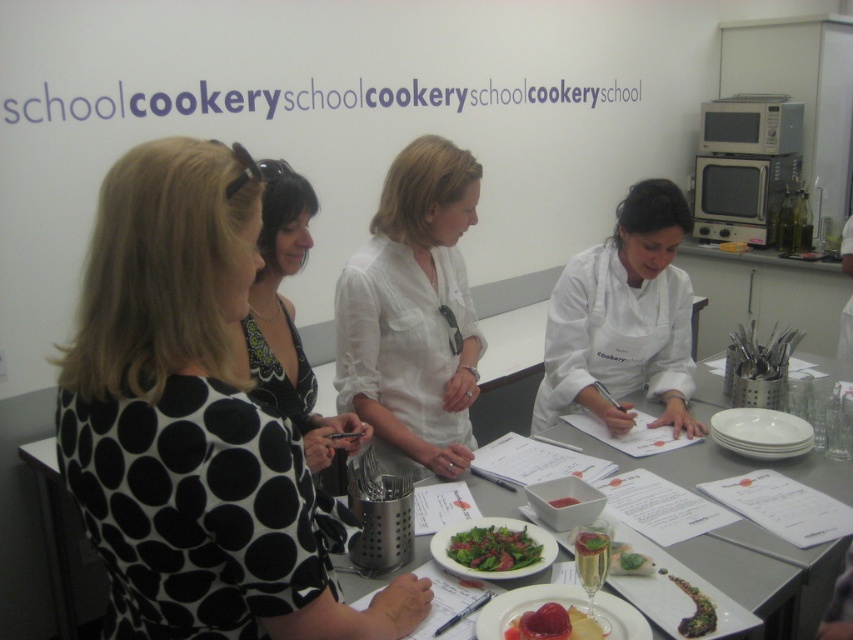
Is white cotton shirt at center below white glossy platter at lower right?

No.

Identify the location of white cotton shirt at center. (413, 314).

Which is behind, point (693, 625) or point (560, 502)?

The point (560, 502) is more distant.

Is point (699, 589) less distant than point (560, 502)?

Yes, point (699, 589) is in front of point (560, 502).

Locate an element on the screen. This screenshot has height=640, width=853. green leafy vegetable at center is located at coordinates [695, 611].

Does black dotted dress at center appear on the right side of green leafy salad at center?

In fact, black dotted dress at center is to the left of green leafy salad at center.

Between black dotted dress at center and green leafy salad at center, which one is positioned higher?

Positioned higher is black dotted dress at center.

This screenshot has width=853, height=640. Identify the location of black dotted dress at center. (291, 326).

You are a GUI agent. You are given a task and a screenshot of the screen. Output one action in this format:
    pyautogui.click(x=<x>, y=<y>)
    Task: Click on the black dotted dress at center
    
    Given the screenshot: What is the action you would take?
    coord(291,326)